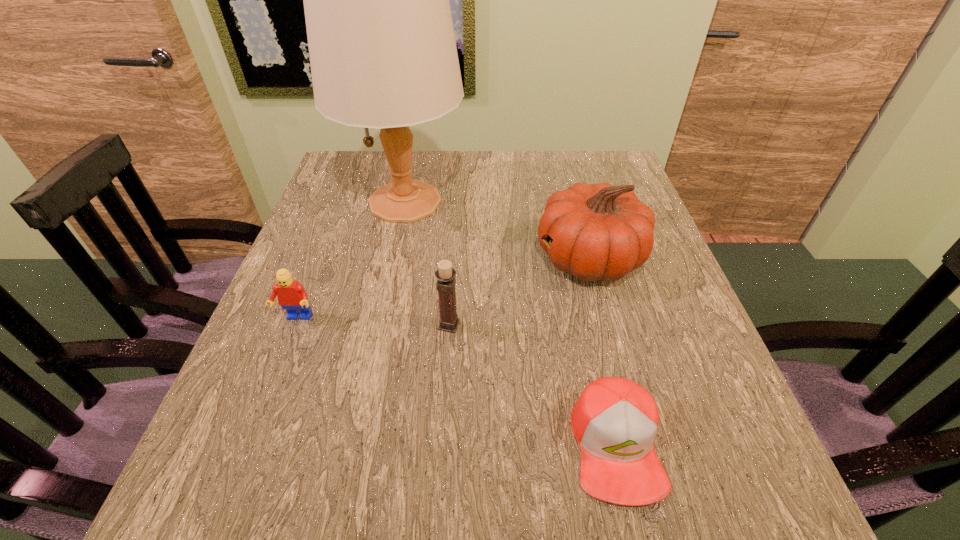
Find the location of a particular element. vacant area situated on the left of the candle holder is located at coordinates pos(265,325).

Image resolution: width=960 pixels, height=540 pixels. What are the coordinates of `vacant region located 0.330m on the front-facing side of the fourth tallest object` in the screenshot? It's located at (220, 514).

Where is `object at the far edge`? This screenshot has height=540, width=960. object at the far edge is located at coordinates (383, 55).

Locate an element on the screen. object positioned at the near edge is located at coordinates (615, 421).

At what (x,y) coordinates should I click in order to perform the action: click on table lamp at the left edge. Please return your answer as a coordinate pair (x, y). Looking at the image, I should click on (383, 55).

Find the location of `Lego that is at the left edge`. Lego that is at the left edge is located at coordinates (291, 295).

What are the coordinates of `pumpkin located in the right edge section of the desktop` in the screenshot? It's located at (602, 232).

Locate an element on the screen. This screenshot has height=540, width=960. baseball cap that is at the right edge is located at coordinates (615, 421).

Identify the location of object that is at the far left corner. The height and width of the screenshot is (540, 960). (383, 55).

Locate an element on the screen. object at the near right corner is located at coordinates (615, 421).